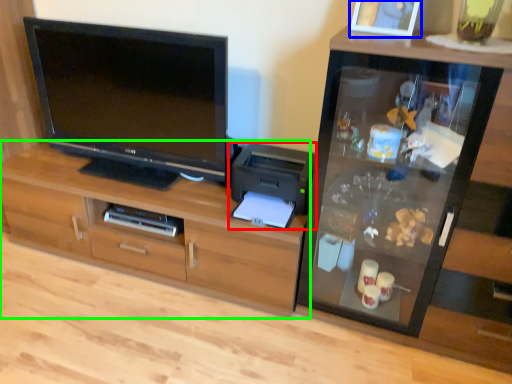
Question: Based on their relative distances, which object is nearer to printer (highlighted by a red box)? Choose from picture frame (highlighted by a blue box) and cabinetry (highlighted by a green box).

Choices:
 (A) picture frame
 (B) cabinetry

Answer: (B)